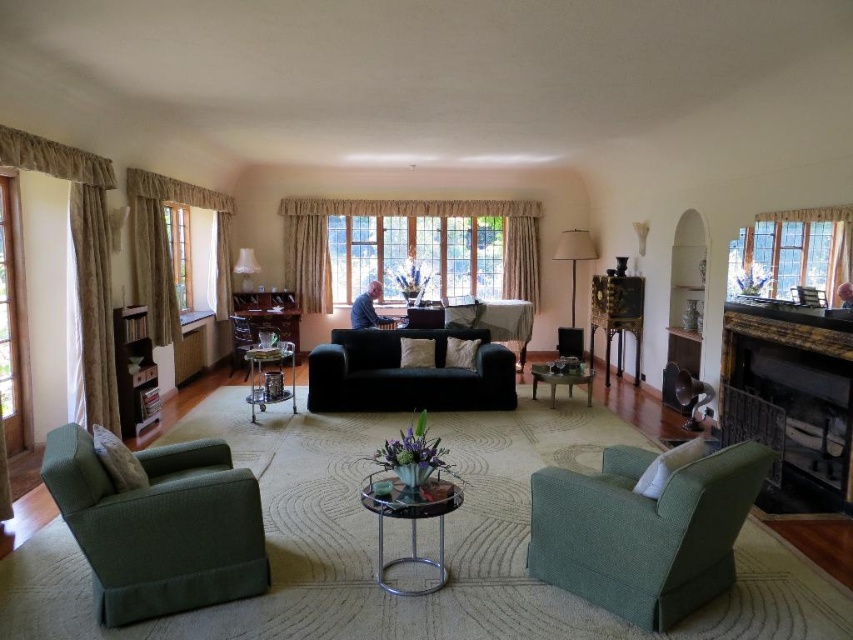
You are standing in the living room and want to move from the sofa to the window. Which object will you pass by first, the green fabric armchair at lower right or the clear glass window at upper right?

The green fabric armchair at lower right is closer to the viewer than the clear glass window at upper right, so you will pass by the green fabric armchair at lower right first on your way to the window.

You are a painter who wants to hang a 3 meter wide canvas between the clear glass window at upper right and the clear glass window at upper left. Can the canvas fit between them without overlapping either window?

The distance between the clear glass window at upper right and the clear glass window at upper left is 6.28 meters. Since the canvas is 3 meters wide, it can fit between them without overlapping either window as there is enough space.